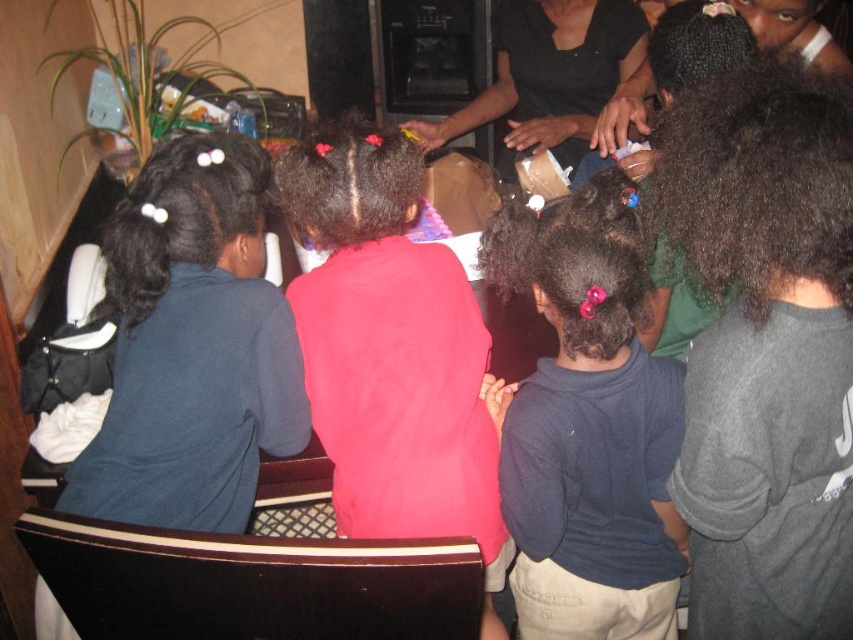
Question: Which of these objects is positioned closest to the dark blue shirt at center?

Choices:
 (A) matte pink shirt at center
 (B) matte blue shirt at left

Answer: (A)

Question: Which of the following is the farthest from the observer?

Choices:
 (A) black matte shirt at upper center
 (B) dark blue shirt at center
 (C) matte pink shirt at center

Answer: (A)

Question: Can you confirm if matte pink shirt at center is wider than black matte shirt at upper center?

Choices:
 (A) no
 (B) yes

Answer: (A)

Question: Does matte pink shirt at center appear on the right side of black matte shirt at upper center?

Choices:
 (A) no
 (B) yes

Answer: (A)

Question: Does matte blue shirt at left lie behind matte pink shirt at center?

Choices:
 (A) yes
 (B) no

Answer: (B)

Question: Which point is closer to the camera taking this photo?

Choices:
 (A) click(526, 51)
 (B) click(257, 410)
 (C) click(321, 376)

Answer: (B)